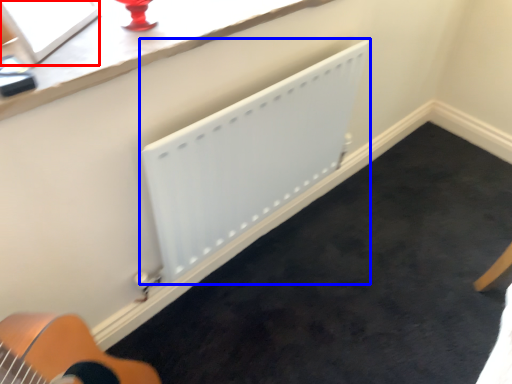
Question: Which of the following is the closest to the observer, window screen (highlighted by a red box) or radiator (highlighted by a blue box)?

Choices:
 (A) window screen
 (B) radiator

Answer: (A)